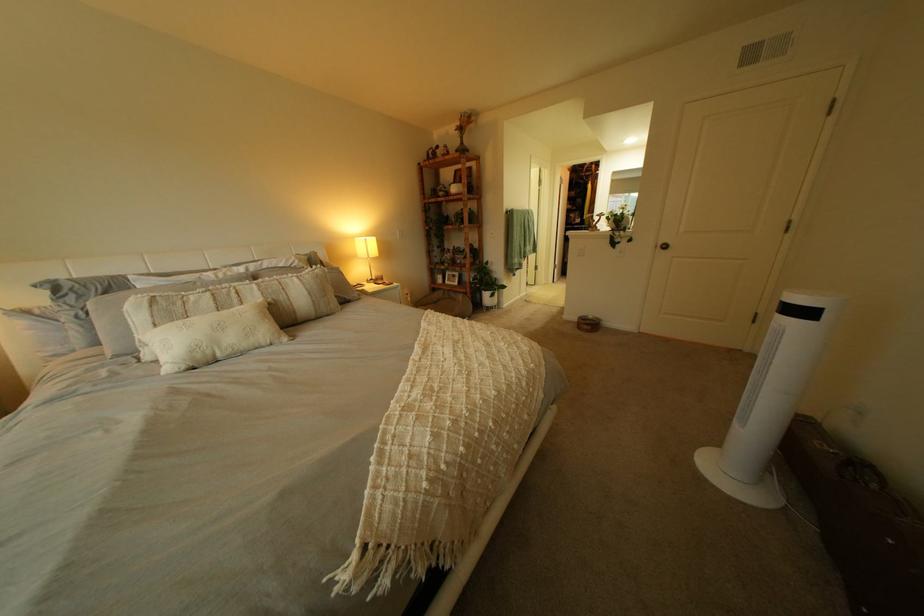
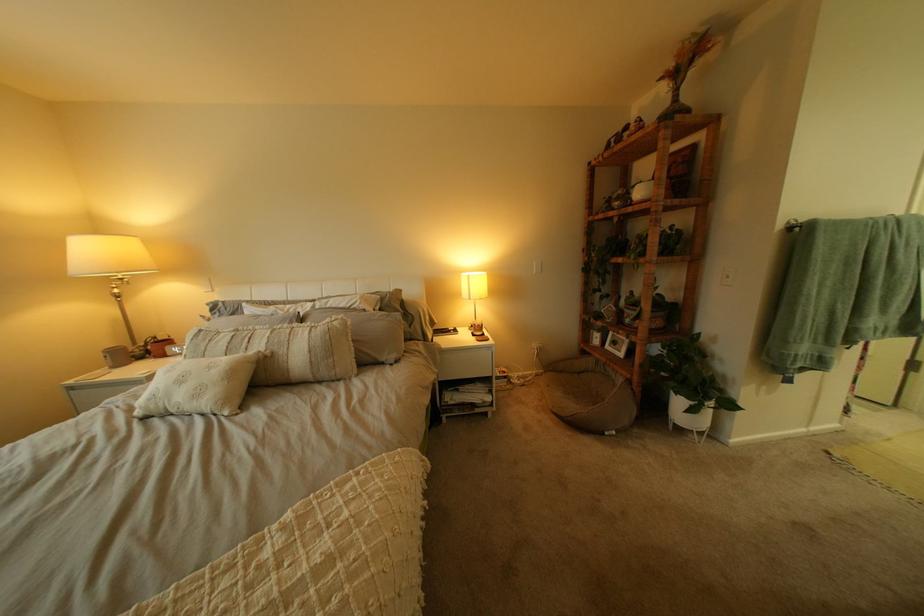
Find the pixel in the second image that matches [224,353] in the first image.

(176, 405)